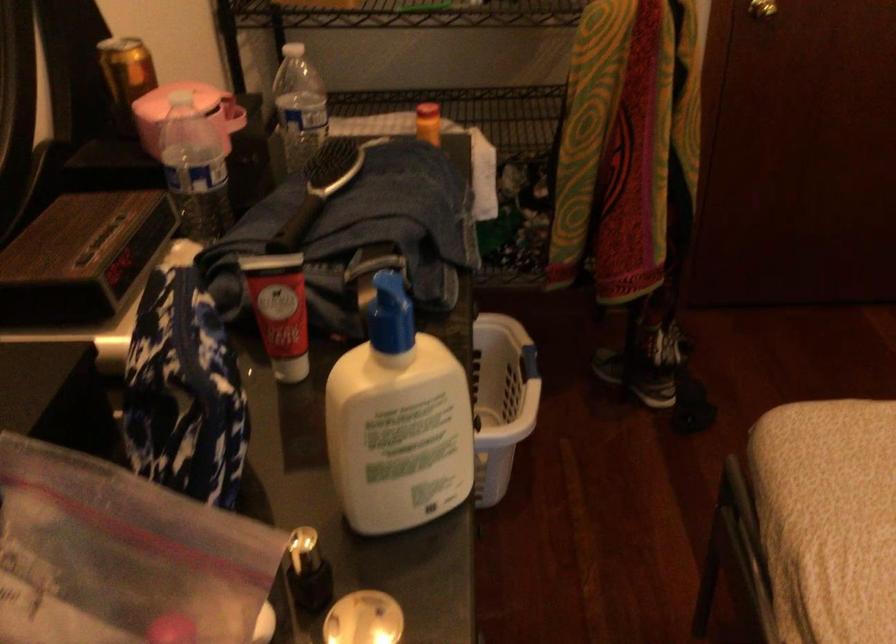
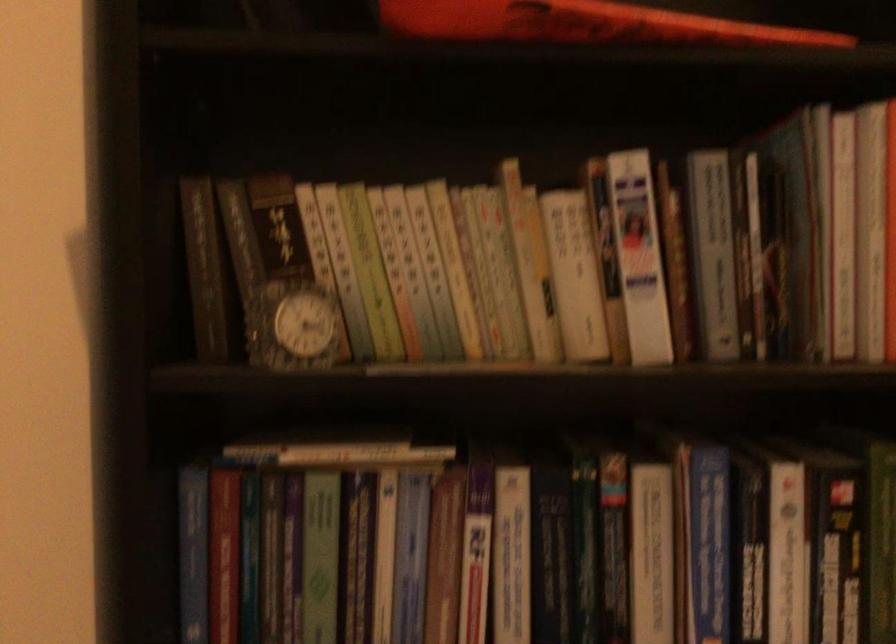
Question: The camera is either moving clockwise (left) or counter-clockwise (right) around the object. The first image is from the beginning of the video and the second image is from the end. Is the camera moving left or right when shooting the video?

Choices:
 (A) Left
 (B) Right

Answer: (B)